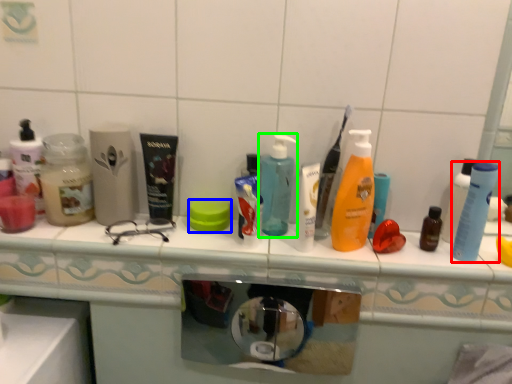
Question: Which is farther away from cleaning product (highlighted by a red box)? soap (highlighted by a blue box) or bottle (highlighted by a green box)?

Choices:
 (A) soap
 (B) bottle

Answer: (A)